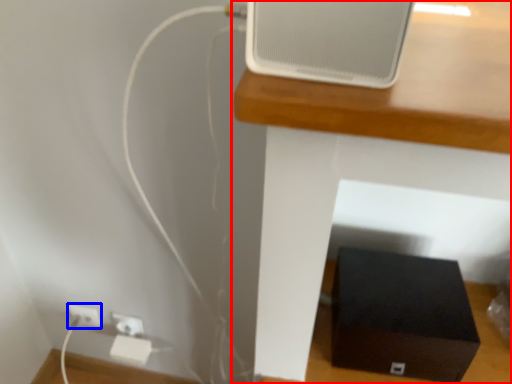
Question: Which object appears closest to the camera in this image, furniture (highlighted by a red box) or electric outlet (highlighted by a blue box)?

Choices:
 (A) furniture
 (B) electric outlet

Answer: (A)